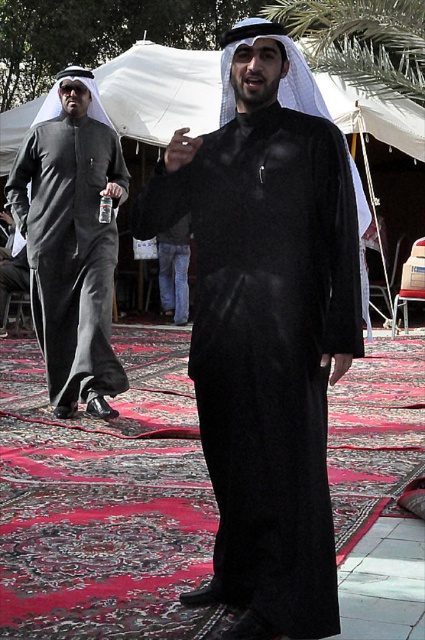
Between black matte robe at center and matte black robe at left, which one is positioned higher?

matte black robe at left is higher up.

Is black matte robe at center bigger than matte black robe at left?

No, black matte robe at center is not bigger than matte black robe at left.

Who is more distant from viewer, (220,205) or (61,257)?

Positioned behind is point (61,257).

Identify the location of black matte robe at center. Image resolution: width=425 pixels, height=640 pixels. (266, 330).